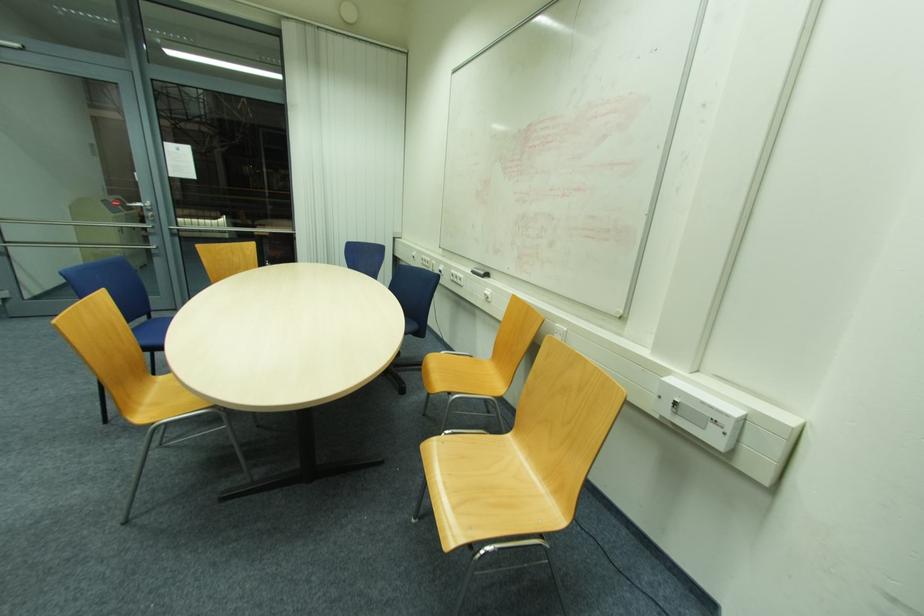
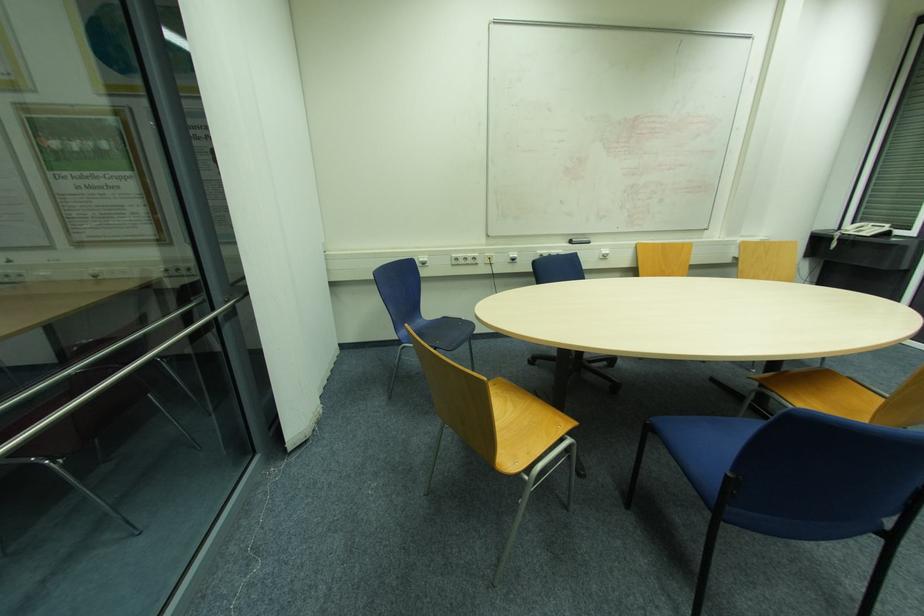
In the second image, find the point that corresponds to [475,273] in the first image.

(574, 244)